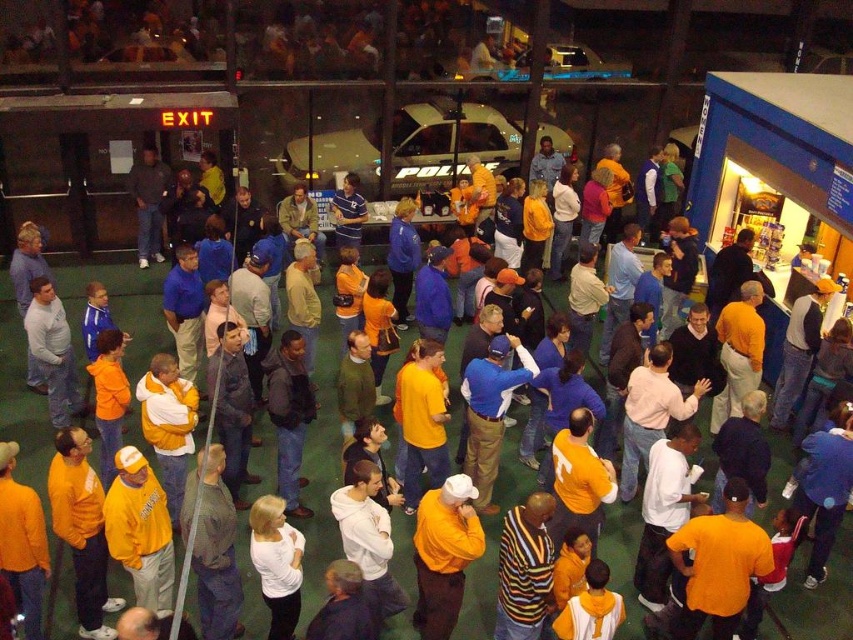
Can you confirm if matte yellow shirt at center is thinner than white matte shirt at center?

In fact, matte yellow shirt at center might be wider than white matte shirt at center.

Where is `matte yellow shirt at center`? The height and width of the screenshot is (640, 853). matte yellow shirt at center is located at coordinates (444, 554).